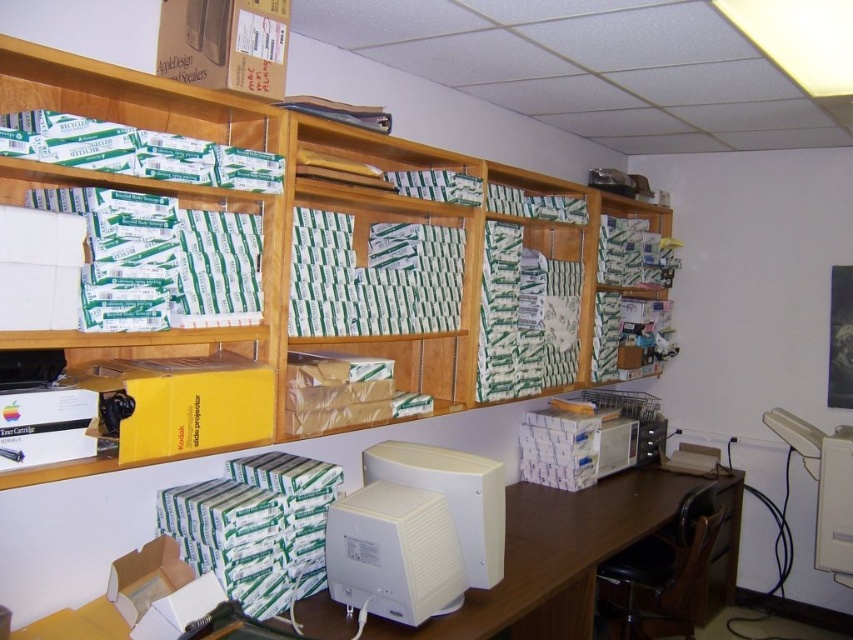
Question: Which object is the closest to the white plastic printer at right?

Choices:
 (A) white plastic monitor at center
 (B) wooden shelves at upper center

Answer: (B)

Question: Can you confirm if yellow cardboard projector at center is thinner than white plastic monitor at center?

Choices:
 (A) no
 (B) yes

Answer: (A)

Question: Can you confirm if yellow cardboard projector at center is positioned above white matte computer monitor at center?

Choices:
 (A) no
 (B) yes

Answer: (B)

Question: Which of the following is the farthest from the observer?

Choices:
 (A) white plastic monitor at center
 (B) yellow cardboard projector at center
 (C) white plastic computer desk at center

Answer: (C)

Question: Is yellow cardboard projector at center to the left of white plastic printer at right from the viewer's perspective?

Choices:
 (A) yes
 (B) no

Answer: (A)

Question: Based on their relative distances, which object is nearer to the white matte computer monitor at center?

Choices:
 (A) white plastic computer desk at center
 (B) white plastic printer at right
 (C) yellow cardboard projector at center
 (D) white plastic monitor at center

Answer: (D)